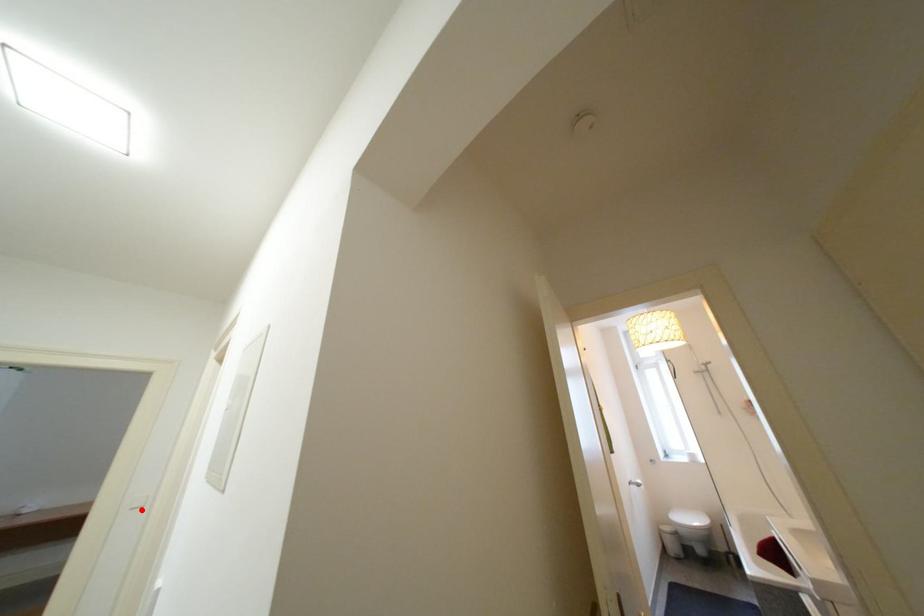
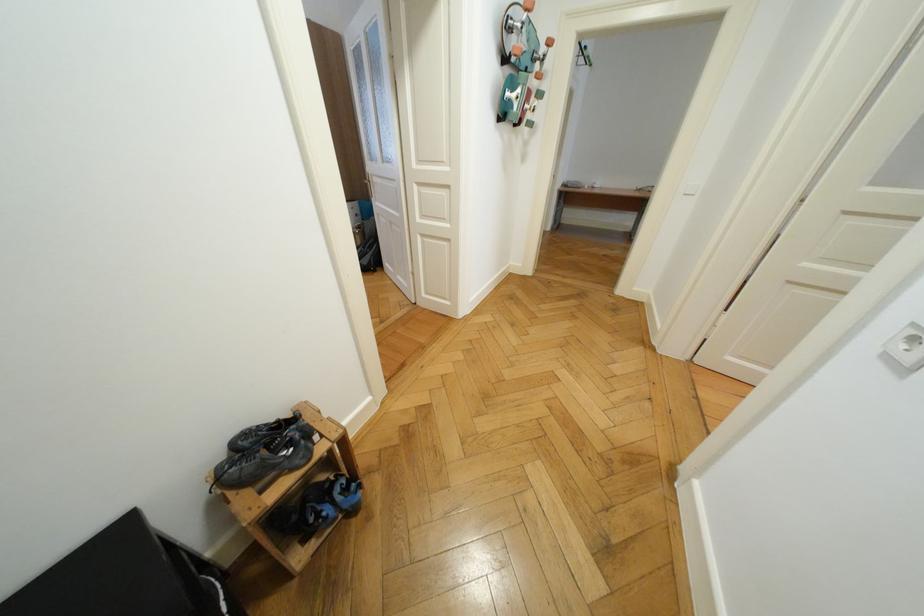
Find the pixel in the second image that matches the highlighted location in the first image.

(695, 196)